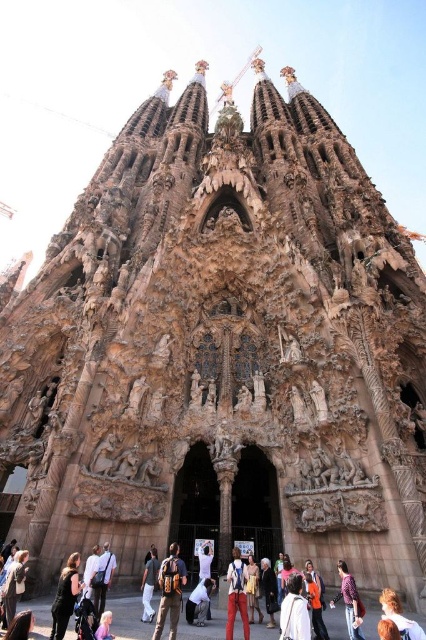
Question: Considering the real-world distances, which object is farthest from the white fabric bag at lower center?

Choices:
 (A) brown leather backpack at lower center
 (B) dark blue denim jacket at center
 (C) light brown leather backpack at center

Answer: (C)

Question: Which point is farther to the camera?

Choices:
 (A) orange fabric at center
 (B) plaid shirt at center
 (C) dark blue denim jacket at center
 (D) blonde hair at lower right

Answer: (C)

Question: Which of the following is the farthest from the observer?

Choices:
 (A) (345, 579)
 (B) (400, 627)
 (C) (310, 564)
 (D) (106, 634)

Answer: (C)

Question: Can you confirm if white fabric bag at lower center is thinner than orange fabric at center?

Choices:
 (A) no
 (B) yes

Answer: (A)

Question: Observing the image, what is the correct spatial positioning of white cotton pants at lower center in reference to denim jacket at lower center?

Choices:
 (A) left
 (B) right

Answer: (A)

Question: Can you confirm if white cotton pants at lower center is positioned to the left of light blue denim jacket at lower center?

Choices:
 (A) yes
 (B) no

Answer: (B)